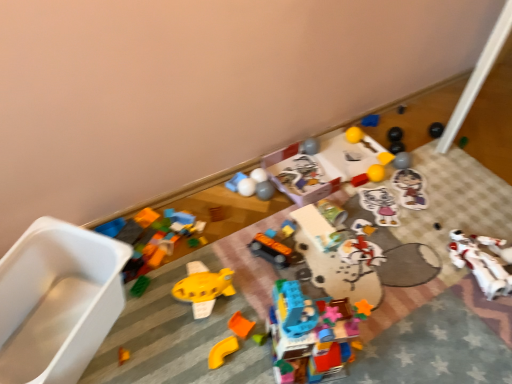
The width and height of the screenshot is (512, 384). Identify the location of vacant area that lies between matte white plush cat at center, the thirteenth toy viewed from the left, and orange matte plastic toy at lower center, the third toy when ordered from left to right. (329, 256).